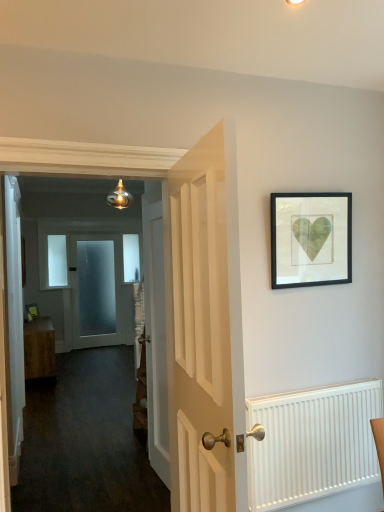
Question: Would you say smooth white door at center is inside or outside clear glass window at upper left, which appears as the 1th window when viewed from the front?

Choices:
 (A) outside
 (B) inside

Answer: (A)

Question: In terms of size, does smooth white door at center appear bigger or smaller than clear glass window at upper left, acting as the 2th window starting from the back?

Choices:
 (A) big
 (B) small

Answer: (A)

Question: Which object is the farthest from the white ribbed radiator at lower right?

Choices:
 (A) clear glass window at center, which appears as the 1th window when viewed from the back
 (B) white wooden door at center, arranged as the 1th door when viewed from the right
 (C) frosted glass door at center, acting as the third door starting from the front
 (D) smooth white door at center
 (E) wooden cabinet at left

Answer: (C)

Question: Considering the real-world distances, which object is closest to the clear glass window at upper left, acting as the 2th window starting from the back?

Choices:
 (A) white wooden door at center, arranged as the 1th door when viewed from the right
 (B) white ribbed radiator at lower right
 (C) wooden cabinet at left
 (D) frosted glass door at center, acting as the third door starting from the front
 (E) clear glass window at center, the 2th window from the front

Answer: (D)